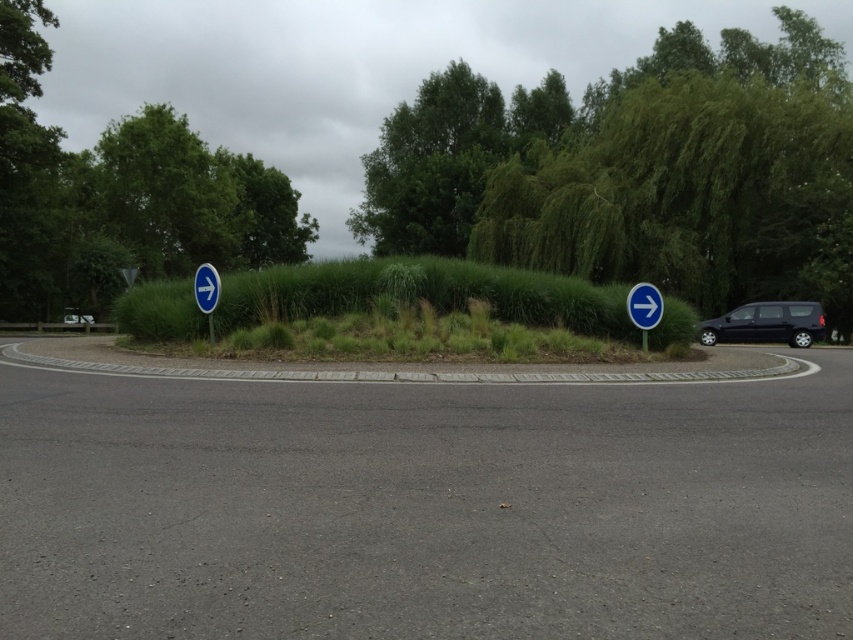
Question: Which of these objects is positioned farthest from the blue circular sign at right?

Choices:
 (A) green grassy hedge at center
 (B) green leafy tree at center
 (C) blue plastic signpost at right

Answer: (B)

Question: Which object appears farthest from the camera in this image?

Choices:
 (A) green leafy tree at upper left
 (B) green leafy tree at center
 (C) blue plastic signpost at right
 (D) green grassy hedge at center

Answer: (A)

Question: Can you confirm if green grassy hedge at center is smaller than blue plastic sign at left?

Choices:
 (A) yes
 (B) no

Answer: (B)

Question: Is green leafy tree at upper left to the left of green grassy hedge at center from the viewer's perspective?

Choices:
 (A) no
 (B) yes

Answer: (B)

Question: Does green leafy tree at upper center have a lesser width compared to blue plastic signpost at left?

Choices:
 (A) no
 (B) yes

Answer: (A)

Question: Among these objects, which one is farthest from the camera?

Choices:
 (A) green leafy tree at center
 (B) green leafy tree at upper left
 (C) blue plastic sign at left
 (D) green grassy hedge at center

Answer: (B)